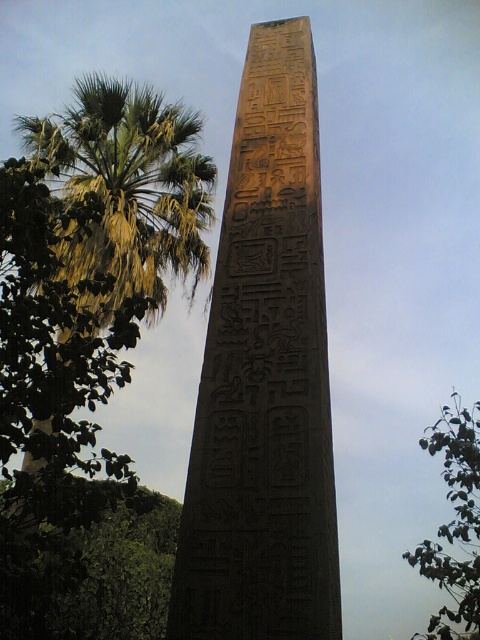
You are standing in front of the obelisk and want to determine which tree is taller. Based on the scene, which one is taller between the green leafy palm tree at left and the green leafy tree at upper right?

The green leafy tree at upper right is taller than the green leafy palm tree at left.